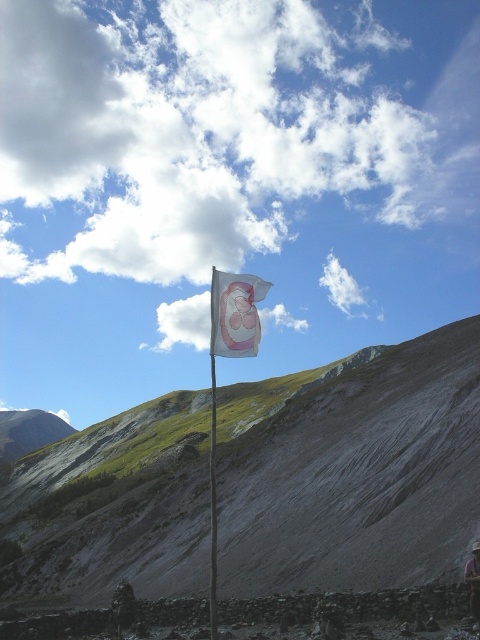
You are a hiker who wants to take a photo of the pink fabric flag at center without the smooth gray rock at center blocking the view. Is there a way to position yourself so that the flag is visible without the rock in front of it?

The pink fabric flag at center is behind the smooth gray rock at center, so you would need to move to a position where the rock is not between you and the flag. This could involve moving around to the side or behind the rock to get a clear view of the flag without obstruction.

You are standing at the point marked as point (235, 314) in the image. What object is exactly at your current location?

The pink fabric flag at center is exactly at point (235, 314).